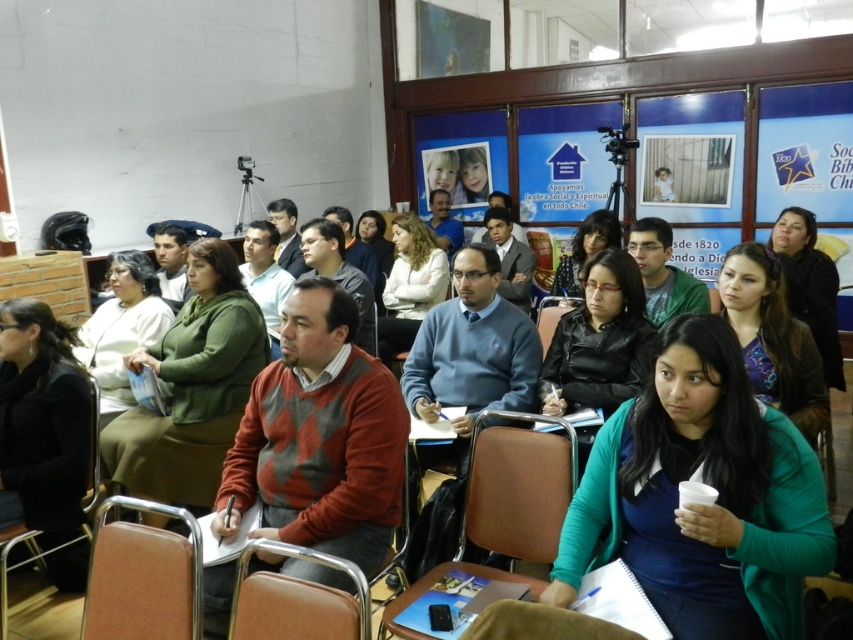
Who is higher up, brown wood chair at center or brown leather chair at center?

Positioned higher is brown leather chair at center.

This screenshot has height=640, width=853. What are the coordinates of `brown wood chair at center` in the screenshot? It's located at (320, 570).

What do you see at coordinates (320, 570) in the screenshot? I see `brown wood chair at center` at bounding box center [320, 570].

Where is `brown wood chair at center`? The image size is (853, 640). brown wood chair at center is located at coordinates (320, 570).

In the scene shown: Does brown leather chair at lower left have a smaller size compared to brown wood chair at center?

Indeed, brown leather chair at lower left has a smaller size compared to brown wood chair at center.

Which of these two, brown leather chair at lower left or brown wood chair at center, stands shorter?

Standing shorter between the two is brown leather chair at lower left.

Image resolution: width=853 pixels, height=640 pixels. I want to click on brown leather chair at lower left, so click(142, 577).

Does point (192, 566) come farther from viewer compared to point (552, 326)?

No, it is in front of (552, 326).

This screenshot has height=640, width=853. Find the location of `brown leather chair at lower left`. brown leather chair at lower left is located at coordinates (142, 577).

Locate an element on the screen. The height and width of the screenshot is (640, 853). brown leather chair at lower left is located at coordinates (142, 577).